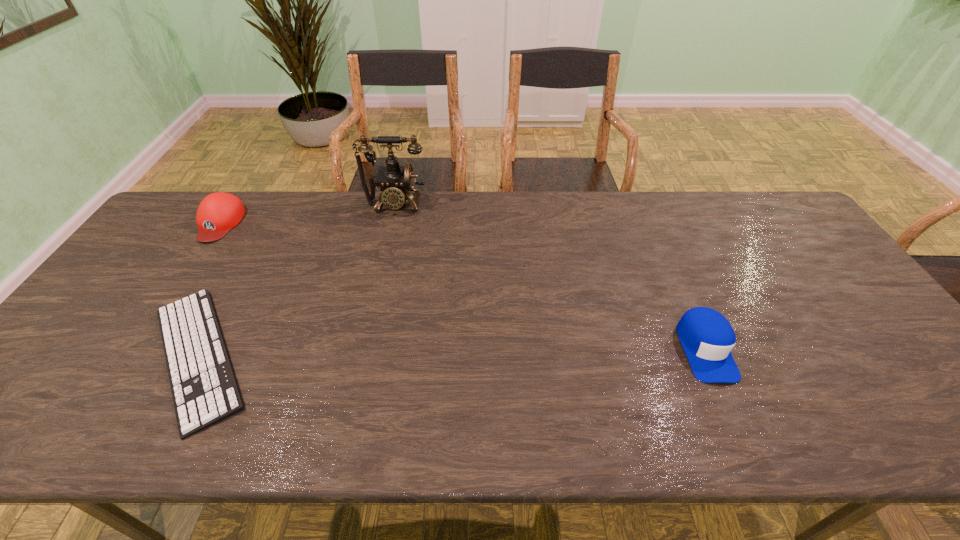
Locate an element on the screen. This screenshot has height=540, width=960. telephone situated at the far edge is located at coordinates (395, 181).

Image resolution: width=960 pixels, height=540 pixels. Find the location of `baseball cap that is at the far edge`. baseball cap that is at the far edge is located at coordinates (219, 212).

At what (x,y) coordinates should I click in order to perform the action: click on object at the near edge. Please return your answer as a coordinate pair (x, y). The width and height of the screenshot is (960, 540). Looking at the image, I should click on pos(204,389).

Identify the location of object at the left edge. (219, 212).

In order to click on object that is positioned at the far left corner in this screenshot , I will do `click(219, 212)`.

Identify the location of vacant space at the far edge of the desktop. (300, 192).

Where is `blank space at the near edge`? This screenshot has height=540, width=960. blank space at the near edge is located at coordinates (378, 411).

In the image, there is a desktop. What are the coordinates of `vacant space at the left edge` in the screenshot? It's located at (102, 304).

Image resolution: width=960 pixels, height=540 pixels. Find the location of `free space at the right edge`. free space at the right edge is located at coordinates (836, 285).

I want to click on vacant space at the far right corner of the desktop, so click(x=767, y=191).